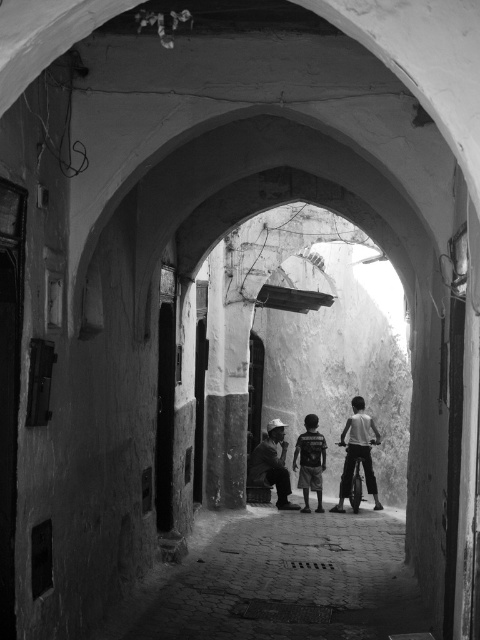
Is light brown wooden bicycle at center wider than smooth fabric shirt at center?

Yes.

Which is below, light brown wooden bicycle at center or smooth fabric shirt at center?

smooth fabric shirt at center

Does point (370, 481) lie behind point (279, 472)?

That is False.

Locate an element on the screen. The width and height of the screenshot is (480, 640). light brown wooden bicycle at center is located at coordinates (358, 452).

Can you confirm if light brown wooden bicycle at center is smaller than striped t-shirt at center?

No, light brown wooden bicycle at center is not smaller than striped t-shirt at center.

This screenshot has height=640, width=480. Identify the location of light brown wooden bicycle at center. 358,452.

Who is more distant from viewer, (372, 433) or (300, 472)?

Positioned behind is point (300, 472).

Locate an element on the screen. The image size is (480, 640). light brown wooden bicycle at center is located at coordinates (358, 452).

Is smooth fabric shirt at center wider than striped t-shirt at center?

Indeed, smooth fabric shirt at center has a greater width compared to striped t-shirt at center.

Can you confirm if smooth fabric shirt at center is positioned above striped t-shirt at center?

No, smooth fabric shirt at center is not above striped t-shirt at center.

This screenshot has width=480, height=640. I want to click on smooth fabric shirt at center, so click(272, 465).